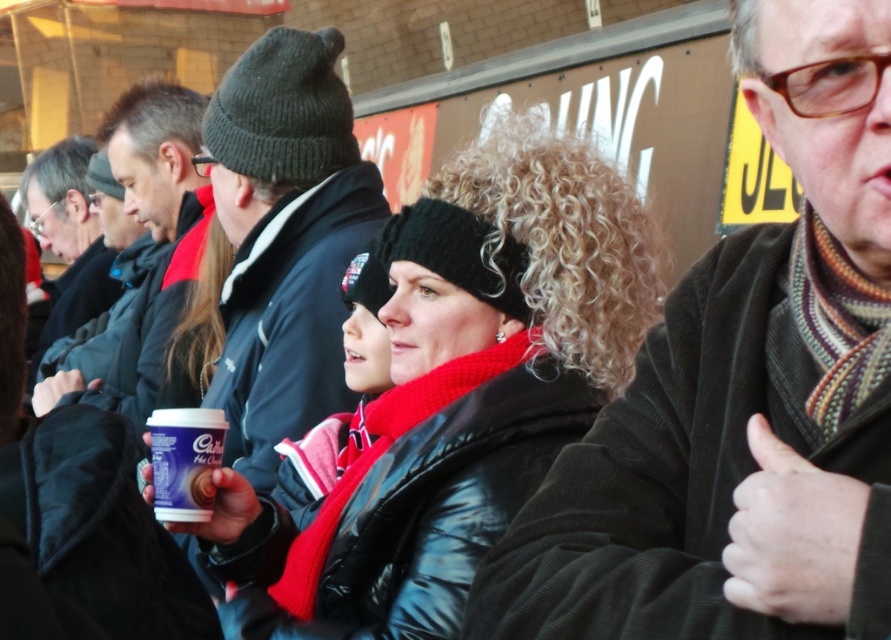
Which is below, knitted wool beanie at upper center or purple matte cup at center?

purple matte cup at center

Does knitted wool beanie at upper center appear on the left side of purple matte cup at center?

In fact, knitted wool beanie at upper center is to the right of purple matte cup at center.

Does point (336, 234) lie in front of point (178, 432)?

No, it is behind (178, 432).

This screenshot has height=640, width=891. Identify the location of knitted wool beanie at upper center. (284, 241).

At what (x,y) coordinates should I click in order to perform the action: click on black matte jacket at center. Please return your answer as a coordinate pair (x, y). The height and width of the screenshot is (640, 891). Looking at the image, I should click on (455, 394).

Is black matte jacket at center closer to camera compared to purple matte cup at center?

That is True.

Describe the element at coordinates (455, 394) in the screenshot. The image size is (891, 640). I see `black matte jacket at center` at that location.

Where is `black matte jacket at center`? The width and height of the screenshot is (891, 640). black matte jacket at center is located at coordinates (455, 394).

Can you confirm if knitted scarf at center is shorter than purple matte cup at center?

Yes, knitted scarf at center is shorter than purple matte cup at center.

Is knitted scarf at center to the right of purple matte cup at center from the viewer's perspective?

Correct, you'll find knitted scarf at center to the right of purple matte cup at center.

Does point (871, 305) come farther from viewer compared to point (197, 488)?

No.

The image size is (891, 640). I want to click on knitted scarf at center, so click(x=742, y=396).